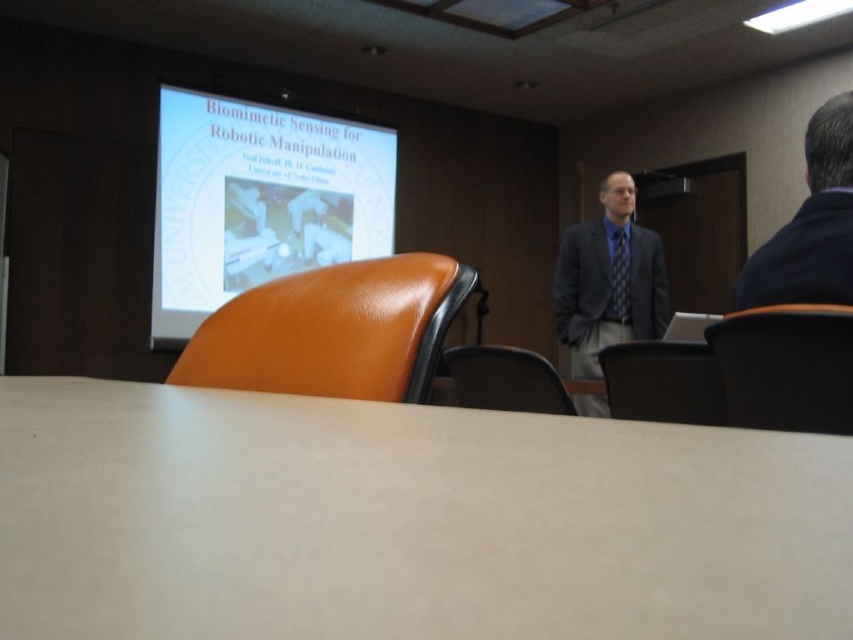
You are sitting in the conference room and want to hand a document to the person wearing the dark blue shirt at upper right. If you can reach 1.5 meters, can you reach them without moving from your seat?

The dark blue shirt at upper right is 1.37 meters away from the camera, so yes, you can reach them without moving from your seat since the distance is within your 1.5 meters reach.